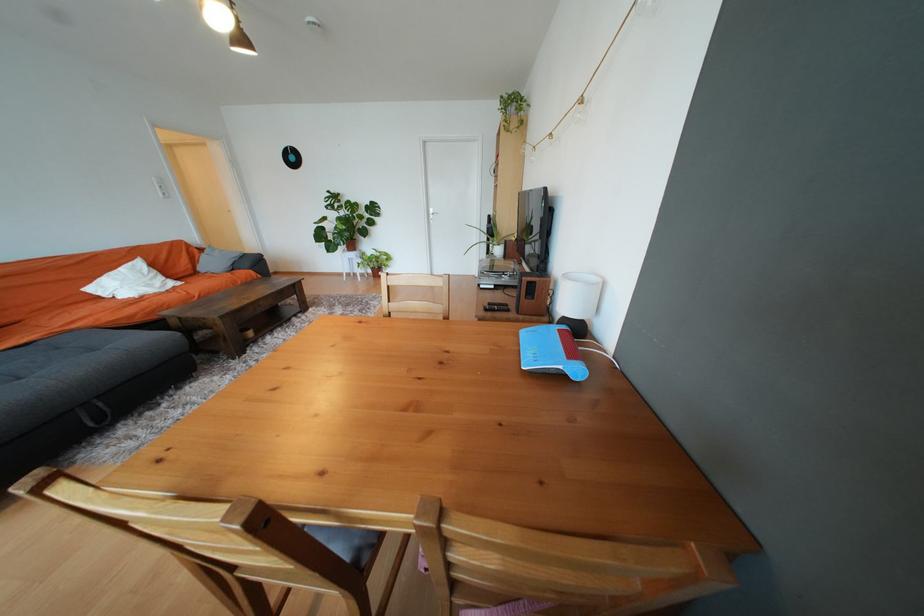
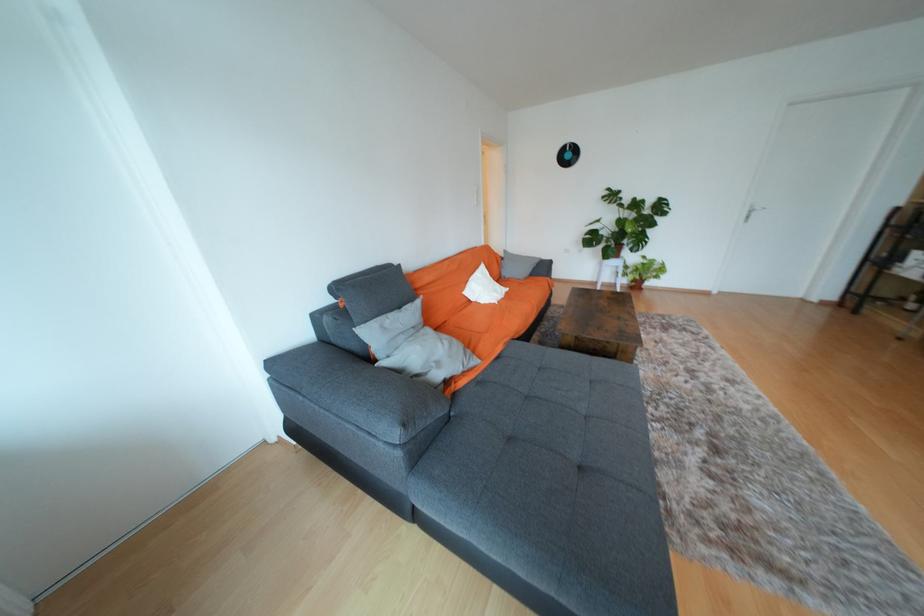
Locate, in the second image, the point that corresponds to the point at 298,159 in the first image.

(574, 156)